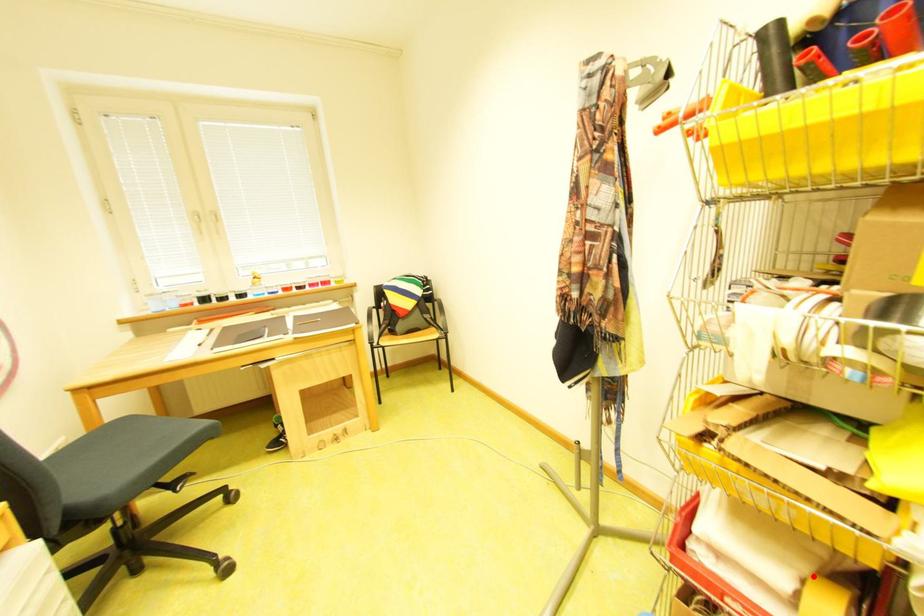
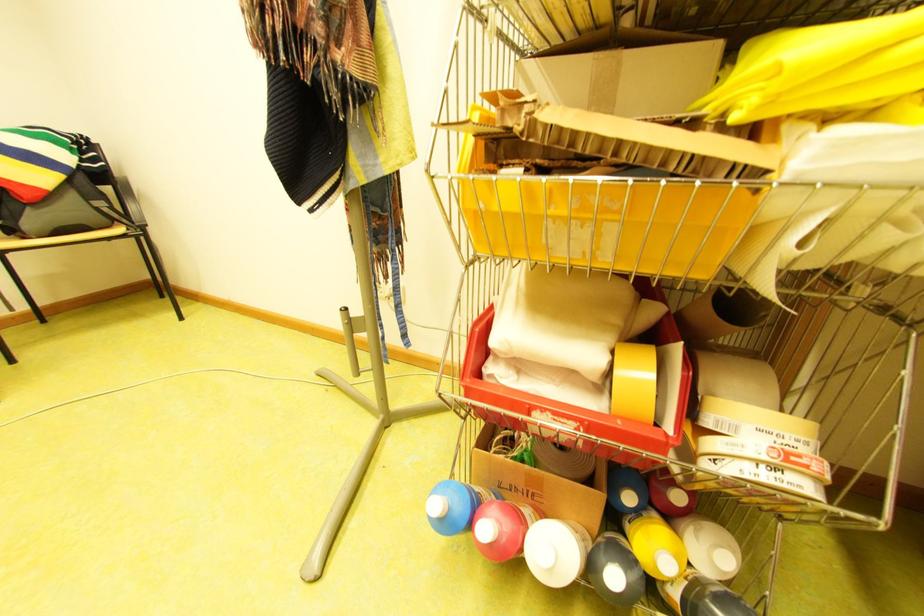
Locate, in the second image, the point that corresponds to the highlighted location in the first image.

(622, 347)